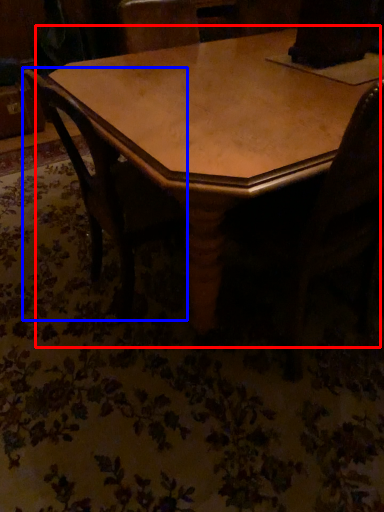
Question: Which object appears farthest to the camera in this image, table (highlighted by a red box) or chair (highlighted by a blue box)?

Choices:
 (A) table
 (B) chair

Answer: (B)